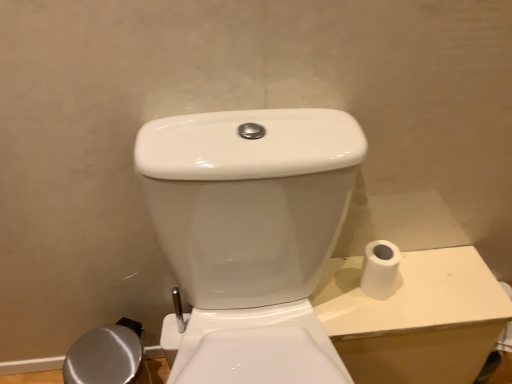
The image size is (512, 384). What are the coordinates of `blank space to the left of white matte toilet paper at right` in the screenshot? It's located at (337, 284).